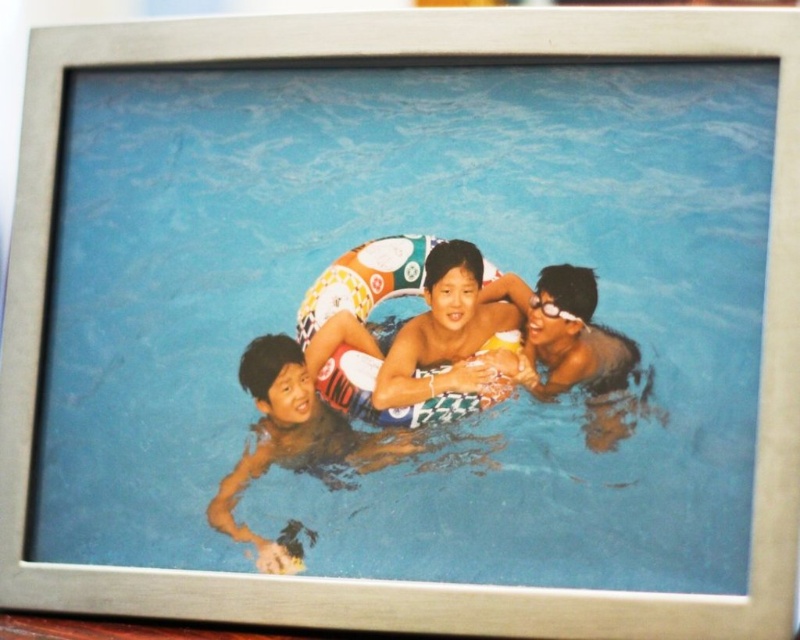
You are standing at the edge of the swimming pool and see the smooth yellow lifebuoy at center. If you want to grab it, will you have to reach further than 3 feet?

The smooth yellow lifebuoy at center is 33.99 inches away from the viewer. Since 33.99 inches is approximately 2.83 feet, which is less than 3 feet, you can grab it without reaching further than 3 feet.

Based on the scene description, where is the smooth skin boy at center located in terms of coordinates?

The smooth skin boy at center is located at coordinates point (296, 432).

You are a lifeguard observing the pool area. There is a smooth yellow lifebuoy at center and a glossy black swimmer at center. Which object is located to the left of the other?

The smooth yellow lifebuoy at center is positioned on the left side of the glossy black swimmer at center.